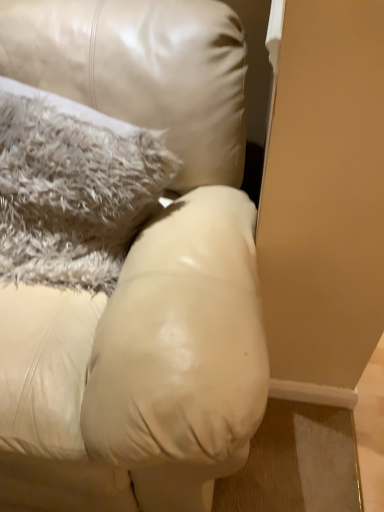
What do you see at coordinates (143, 284) in the screenshot?
I see `matte leather couch at center` at bounding box center [143, 284].

Where is `matte leather couch at center`? matte leather couch at center is located at coordinates (143, 284).

In order to face matte leather couch at center, should I rotate leftwards or rightwards?

To face it directly, rotate left by 18.656 degrees.

Measure the distance between point (58, 297) and camera.

They are 37.87 inches apart.

Describe the element at coordinates (72, 193) in the screenshot. I see `fuzzy gray pillow at upper left` at that location.

In the scene shown: In order to face fuzzy gray pillow at upper left, should I rotate leftwards or rightwards?

To align with it, rotate left about 19.695°.

In order to click on fuzzy gray pillow at upper left in this screenshot , I will do `click(72, 193)`.

Locate an element on the screen. matte leather couch at center is located at coordinates (143, 284).

Is matte leather couch at center to the left of fuzzy gray pillow at upper left from the viewer's perspective?

Yes, matte leather couch at center is to the left of fuzzy gray pillow at upper left.

Is matte leather couch at center further to camera compared to fuzzy gray pillow at upper left?

No, it is not.

Does point (88, 473) come farther from viewer compared to point (81, 271)?

No, (88, 473) is in front of (81, 271).

From the image's perspective, is matte leather couch at center positioned above or below fuzzy gray pillow at upper left?

matte leather couch at center is situated lower than fuzzy gray pillow at upper left in the image.

From a real-world perspective, is matte leather couch at center physically below fuzzy gray pillow at upper left?

Indeed, from a real-world perspective, matte leather couch at center is positioned beneath fuzzy gray pillow at upper left.

Which of these two, matte leather couch at center or fuzzy gray pillow at upper left, is thinner?

Thinner between the two is fuzzy gray pillow at upper left.

Can you confirm if matte leather couch at center is shorter than fuzzy gray pillow at upper left?

No, matte leather couch at center is not shorter than fuzzy gray pillow at upper left.

Does matte leather couch at center have a larger size compared to fuzzy gray pillow at upper left?

Yes.

Could fuzzy gray pillow at upper left be considered to be inside matte leather couch at center?

Yes, fuzzy gray pillow at upper left can be found within matte leather couch at center.

Is matte leather couch at center not near fuzzy gray pillow at upper left?

They are positioned close to each other.

Is matte leather couch at center oriented away from fuzzy gray pillow at upper left?

Yes.

Find the location of a particular element. furniture below the fuzzy gray pillow at upper left (from a real-world perspective) is located at coordinates pyautogui.click(x=143, y=284).

Considering the relative positions of fuzzy gray pillow at upper left and matte leather couch at center in the image provided, is fuzzy gray pillow at upper left to the left of matte leather couch at center from the viewer's perspective?

No, fuzzy gray pillow at upper left is not to the left of matte leather couch at center.

Is fuzzy gray pillow at upper left in front of or behind matte leather couch at center in the image?

In the image, fuzzy gray pillow at upper left appears behind matte leather couch at center.

Considering the points (60, 114) and (201, 459), which point is in front, point (60, 114) or point (201, 459)?

Positioned in front is point (201, 459).

From the image's perspective, is fuzzy gray pillow at upper left above or below matte leather couch at center?

From the image's perspective, fuzzy gray pillow at upper left appears above matte leather couch at center.

From a real-world perspective, which object rests below the other?

From a 3D spatial view, matte leather couch at center is below.

Is fuzzy gray pillow at upper left thinner than matte leather couch at center?

Correct, the width of fuzzy gray pillow at upper left is less than that of matte leather couch at center.

Does fuzzy gray pillow at upper left have a lesser height compared to matte leather couch at center?

Yes, fuzzy gray pillow at upper left is shorter than matte leather couch at center.

Can you confirm if fuzzy gray pillow at upper left is bigger than matte leather couch at center?

No, fuzzy gray pillow at upper left is not bigger than matte leather couch at center.

Based on the photo, is matte leather couch at center surrounded by fuzzy gray pillow at upper left?

No, matte leather couch at center is located outside of fuzzy gray pillow at upper left.

Is fuzzy gray pillow at upper left next to matte leather couch at center?

No, fuzzy gray pillow at upper left is not making contact with matte leather couch at center.

Is fuzzy gray pillow at upper left looking in the opposite direction of matte leather couch at center?

That's right, fuzzy gray pillow at upper left is facing away from matte leather couch at center.

Locate an element on the screen. pillow above the matte leather couch at center (from a real-world perspective) is located at coordinates (72, 193).

This screenshot has height=512, width=384. Identify the location of pillow that appears above the matte leather couch at center (from a real-world perspective). (72, 193).

Locate an element on the screen. This screenshot has width=384, height=512. pillow above the matte leather couch at center (from the image's perspective) is located at coordinates (72, 193).